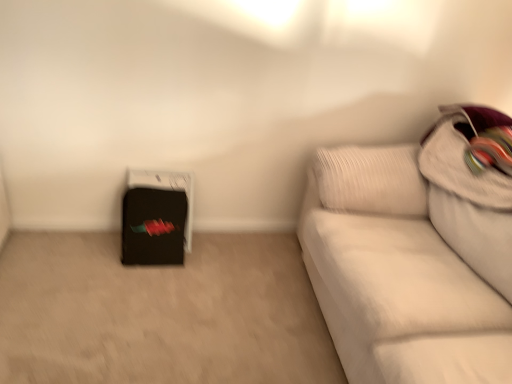
Question: From the image's perspective, is black matte suitcase at lower left located above white fabric couch at right?

Choices:
 (A) no
 (B) yes

Answer: (B)

Question: Is white fabric couch at right a part of black matte suitcase at lower left?

Choices:
 (A) no
 (B) yes

Answer: (A)

Question: Is black matte suitcase at lower left wider than white fabric couch at right?

Choices:
 (A) no
 (B) yes

Answer: (A)

Question: From a real-world perspective, is black matte suitcase at lower left below white fabric couch at right?

Choices:
 (A) yes
 (B) no

Answer: (A)

Question: Can we say black matte suitcase at lower left lies outside white fabric couch at right?

Choices:
 (A) no
 (B) yes

Answer: (B)

Question: Is black matte suitcase at lower left shorter than white fabric couch at right?

Choices:
 (A) yes
 (B) no

Answer: (A)

Question: Is white fabric couch at right positioned in front of black matte suitcase at lower left?

Choices:
 (A) no
 (B) yes

Answer: (B)

Question: From the image's perspective, does white fabric couch at right appear lower than black matte suitcase at lower left?

Choices:
 (A) yes
 (B) no

Answer: (A)

Question: Is white fabric couch at right bigger than black matte suitcase at lower left?

Choices:
 (A) yes
 (B) no

Answer: (A)

Question: From a real-world perspective, is white fabric couch at right over black matte suitcase at lower left?

Choices:
 (A) yes
 (B) no

Answer: (A)

Question: Is white fabric couch at right taller than black matte suitcase at lower left?

Choices:
 (A) no
 (B) yes

Answer: (B)

Question: Considering the relative sizes of white fabric couch at right and black matte suitcase at lower left in the image provided, is white fabric couch at right smaller than black matte suitcase at lower left?

Choices:
 (A) no
 (B) yes

Answer: (A)

Question: From a real-world perspective, is white textured pillow at upper right located beneath black matte suitcase at lower left?

Choices:
 (A) yes
 (B) no

Answer: (B)